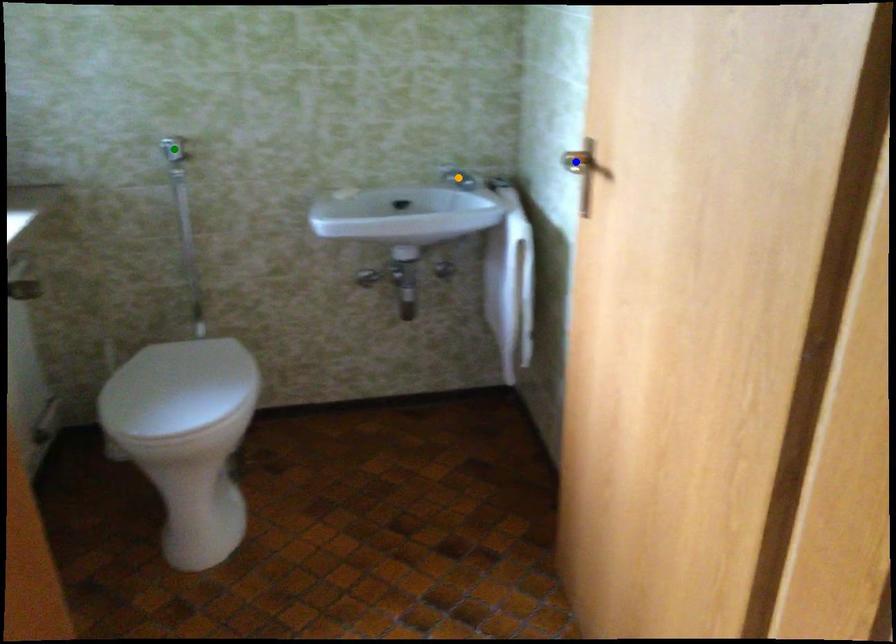
Order these from nearest to farthest:
orange point
blue point
green point

blue point → green point → orange point